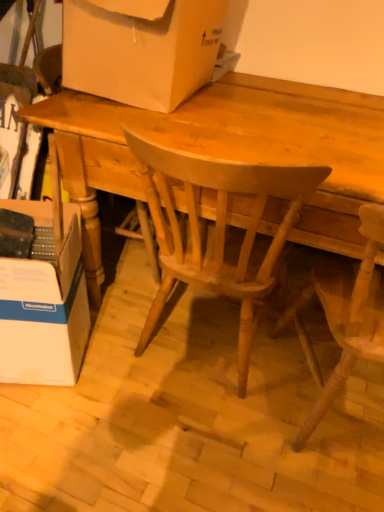
Question: Relative to wooden chair at center, arranged as the first chair when viewed from the right, is light brown wood chair at center, which appears as the second chair when viewed from the right, in front or behind?

Choices:
 (A) behind
 (B) front

Answer: (A)

Question: From the image's perspective, is light brown wood chair at center, which appears as the second chair when viewed from the right, positioned above or below wooden chair at center, arranged as the first chair when viewed from the right?

Choices:
 (A) below
 (B) above

Answer: (B)

Question: Which is nearer to the light brown wood chair at center, the first chair viewed from the left?

Choices:
 (A) white cardboard box at left, which is counted as the 1th box, starting from the bottom
 (B) wooden chair at center, arranged as the first chair when viewed from the right
 (C) wooden desk at center
 (D) matte cardboard box at upper center, which is the first box in top-to-bottom order

Answer: (C)

Question: Which of these objects is positioned closest to the white cardboard box at left, which is counted as the 1th box, starting from the bottom?

Choices:
 (A) light brown wood chair at center, which appears as the second chair when viewed from the right
 (B) matte cardboard box at upper center, acting as the second box starting from the bottom
 (C) wooden desk at center
 (D) wooden chair at center, which appears as the second chair when viewed from the left

Answer: (A)